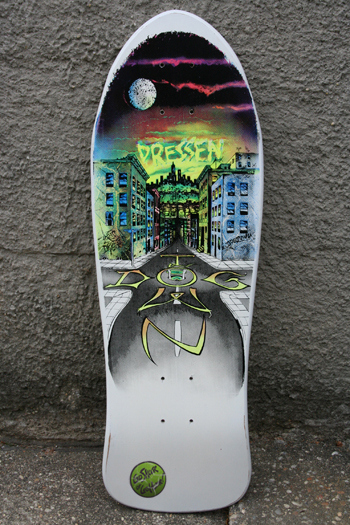
Find the location of a particular element. The height and width of the screenshot is (525, 350). grey concrete wall is located at coordinates (34, 109).